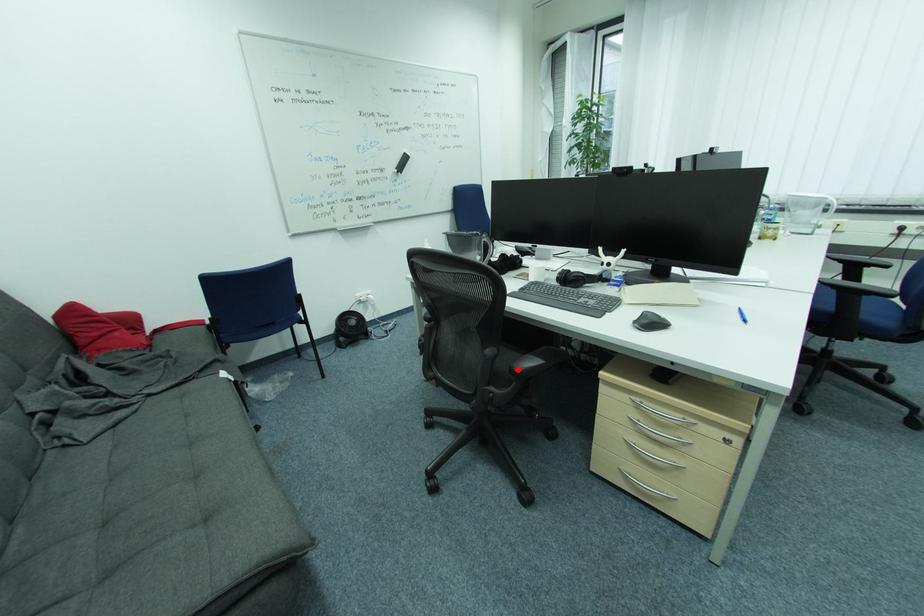
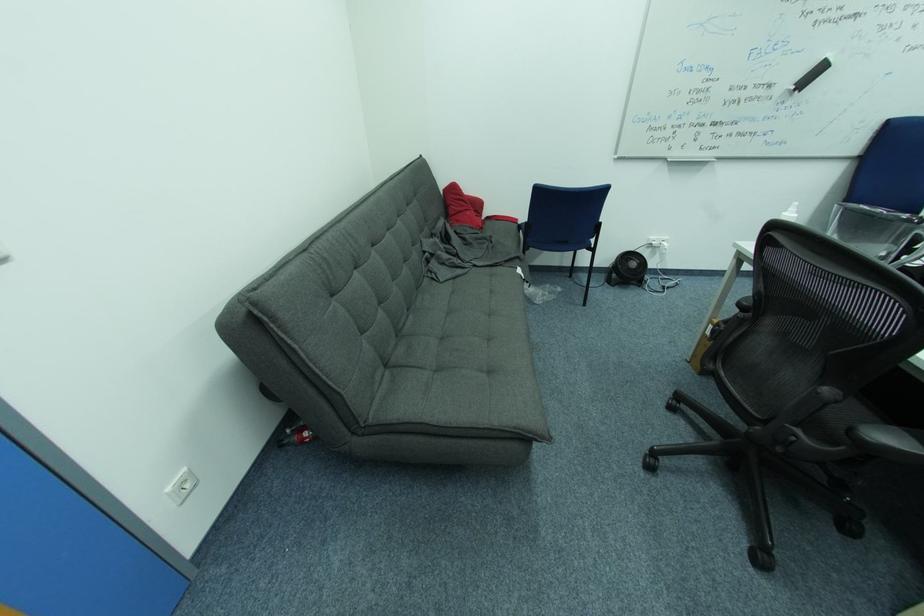
Question: I am providing you with two images of the same scene from different viewpoints. A red point is shown in image1. For the corresponding object point in image2, is it positioned nearer or farther from the camera?

Choices:
 (A) Nearer
 (B) Farther

Answer: (A)